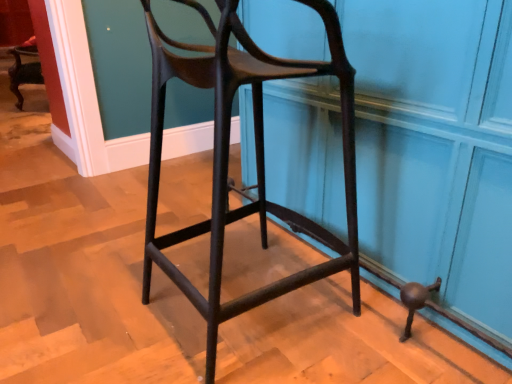
The image size is (512, 384). What are the coordinates of `free space below matte black stool at center (from a real-world perspective)` in the screenshot? It's located at [250, 310].